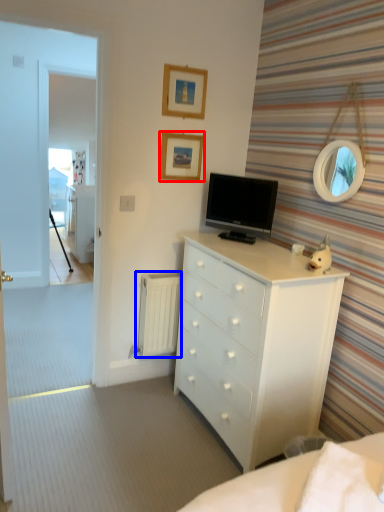
Question: Which object is further to the camera taking this photo, picture frame (highlighted by a red box) or radiator (highlighted by a blue box)?

Choices:
 (A) picture frame
 (B) radiator

Answer: (B)